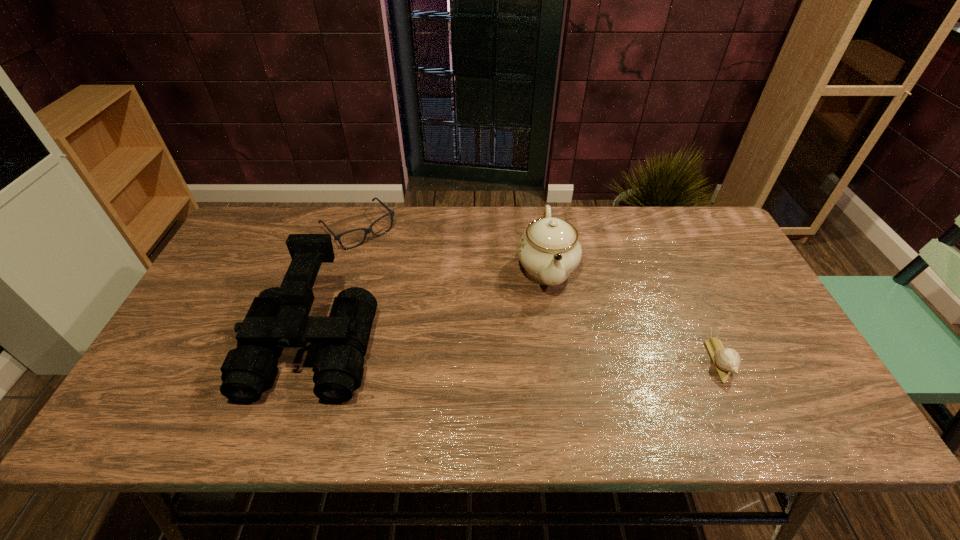
Identify the location of the tallest object. (278, 318).

The width and height of the screenshot is (960, 540). Identify the location of the rightmost object. (726, 360).

Locate an element on the screen. The image size is (960, 540). spectacles is located at coordinates (367, 230).

The height and width of the screenshot is (540, 960). What are the coordinates of `the third object from left to right` in the screenshot? It's located at (549, 250).

Identify the location of the third shortest object. This screenshot has height=540, width=960. (549, 250).

This screenshot has width=960, height=540. I want to click on free space located on the front-facing side of the spectacles, so click(x=445, y=317).

Where is `free space located 0.150m on the front-facing side of the spectacles`? This screenshot has width=960, height=540. free space located 0.150m on the front-facing side of the spectacles is located at coordinates (403, 274).

The image size is (960, 540). Identify the location of vacant space located 0.160m on the front-facing side of the spectacles. (405, 276).

Find the location of a particular element. The image size is (960, 540). vacant region located at the spout of the chinaware is located at coordinates (560, 361).

Identify the location of vacant region located at the spout of the chinaware. This screenshot has height=540, width=960. (555, 329).